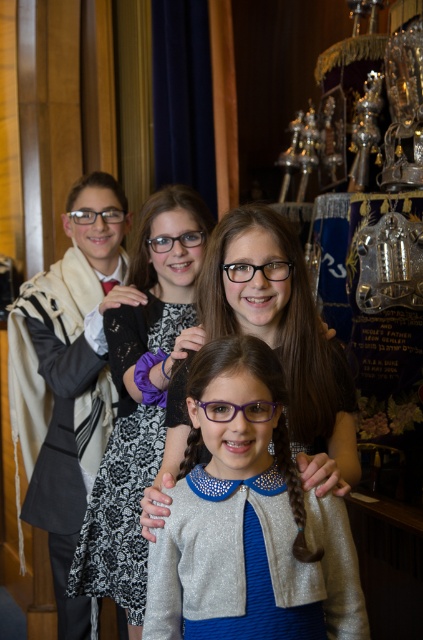
Question: Considering the relative positions of shiny silver cardigan at center and black lace dress at center in the image provided, where is shiny silver cardigan at center located with respect to black lace dress at center?

Choices:
 (A) right
 (B) left

Answer: (A)

Question: Which point appears farthest from the camera in this image?

Choices:
 (A) (206, 609)
 (B) (136, 355)
 (C) (255, 410)

Answer: (B)

Question: Does shiny silver cardigan at center have a smaller size compared to black lace dress at center?

Choices:
 (A) no
 (B) yes

Answer: (B)

Question: Which of these objects is positioned farthest from the purple plastic glasses at center?

Choices:
 (A) black lace dress at center
 (B) shiny silver cardigan at center

Answer: (A)

Question: Which object is farther from the camera taking this photo?

Choices:
 (A) black lace dress at center
 (B) purple plastic glasses at center

Answer: (A)

Question: Is black lace dress at center to the left of purple plastic glasses at center from the viewer's perspective?

Choices:
 (A) no
 (B) yes

Answer: (B)